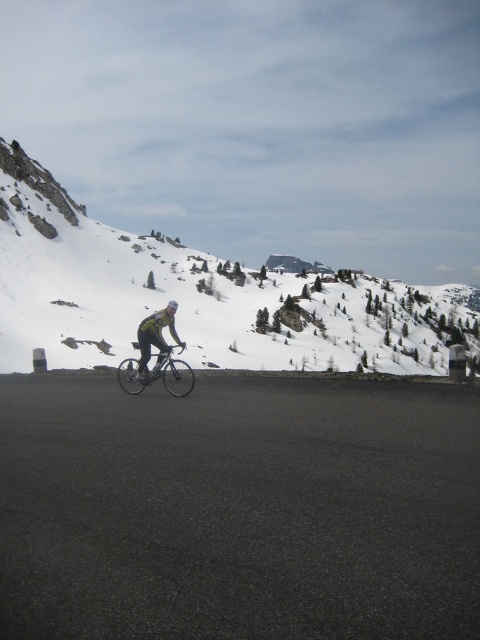
Consider the image. Is yellow-green jersey at center positioned behind yellow matte helmet at center?

No, it is not.

Is yellow-green jersey at center below yellow matte helmet at center?

Correct, yellow-green jersey at center is located below yellow matte helmet at center.

Does point (144, 324) lie behind point (176, 305)?

No, it is not.

Identify the location of yellow-green jersey at center. This screenshot has width=480, height=640. (155, 339).

Is shiny silver bicycle at center positioned in front of yellow-green jersey at center?

Yes, shiny silver bicycle at center is closer to the viewer.

Is shiny silver bicycle at center bigger than yellow-green jersey at center?

Yes.

Is point (169, 364) closer to camera compared to point (171, 332)?

Yes, point (169, 364) is closer to viewer.

Where is `shiny silver bicycle at center`? The image size is (480, 640). shiny silver bicycle at center is located at coordinates (157, 374).

How far apart are snowy rocky mountain at upper center and yellow matte helmet at center?

snowy rocky mountain at upper center is 55.80 meters away from yellow matte helmet at center.

From the picture: Is snowy rocky mountain at upper center positioned at the back of yellow matte helmet at center?

That is True.

The height and width of the screenshot is (640, 480). What are the coordinates of `snowy rocky mountain at upper center` in the screenshot? It's located at (192, 296).